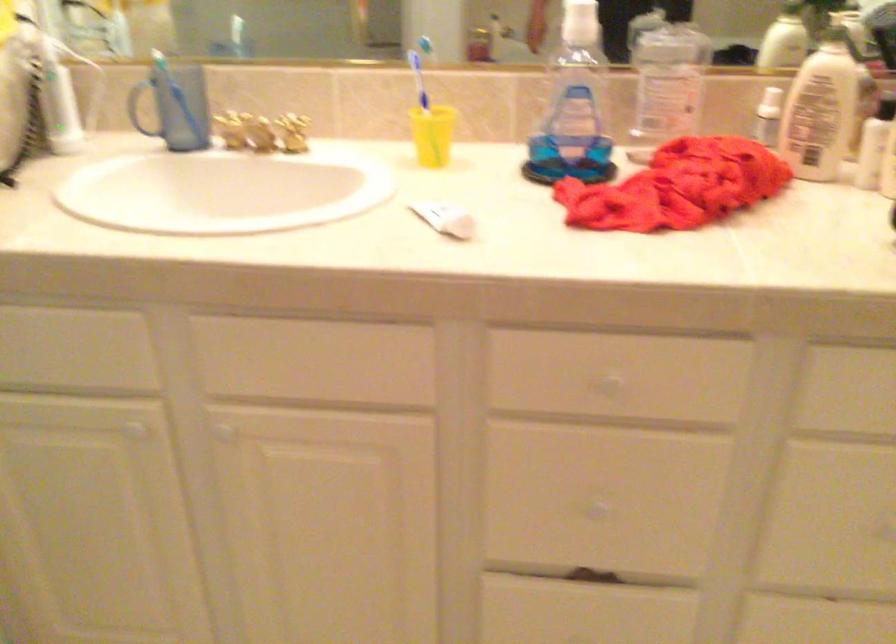
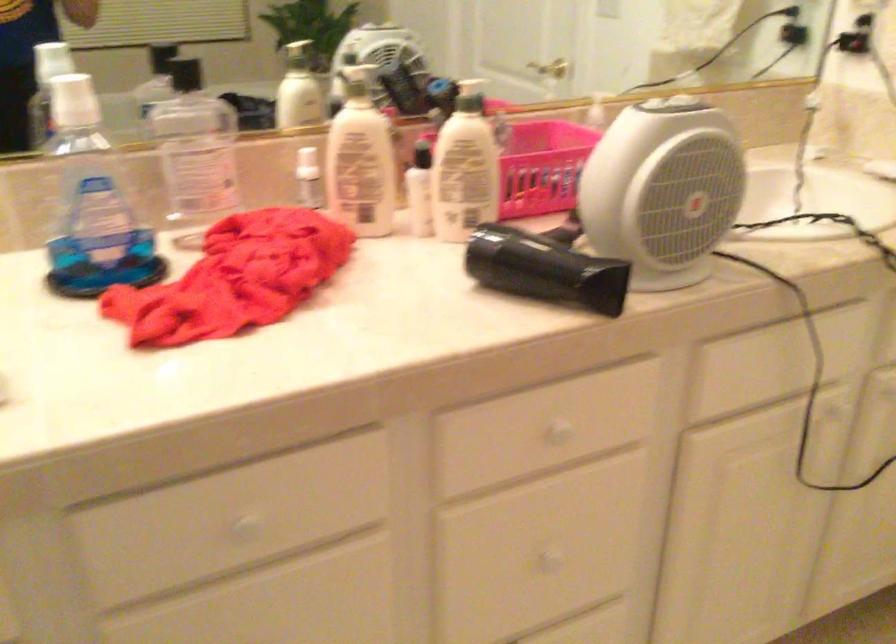
Question: The images are taken continuously from a first-person perspective. In which direction is your viewpoint rotating?

Choices:
 (A) Left
 (B) Right
 (C) Up
 (D) Down

Answer: (B)